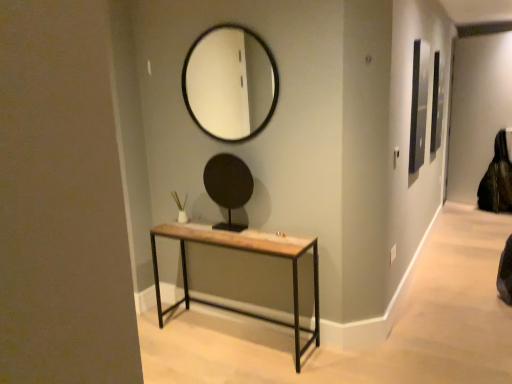
You are a GUI agent. You are given a task and a screenshot of the screen. Output one action in this format:
    pyautogui.click(x=<x>, y=<y>)
    Task: Click on the vacant space underneath rustic wood table at center (from a real-world perspective)
    This screenshot has width=512, height=384.
    Given the screenshot: What is the action you would take?
    pyautogui.click(x=228, y=332)